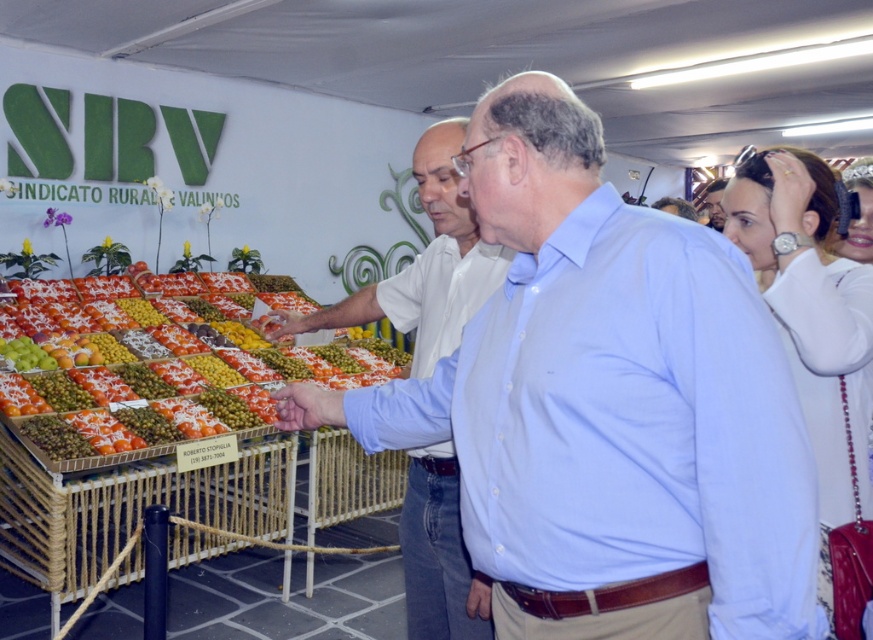
Question: Among these points, which one is nearest to the camera?

Choices:
 (A) (111, 280)
 (B) (413, 314)
 (C) (709, 186)

Answer: (B)

Question: Which object is the closest to the matte white shirt at center?

Choices:
 (A) shiny plastic tray at center
 (B) light blue shirt at center

Answer: (B)

Question: Can you confirm if light blue shirt at center is positioned above matte white shirt at center?

Choices:
 (A) yes
 (B) no

Answer: (B)

Question: Observing the image, what is the correct spatial positioning of shiny plastic tray at center in reference to matte white shirt at center?

Choices:
 (A) below
 (B) above

Answer: (A)

Question: Estimate the real-world distances between objects in this image. Which object is closer to the light blue shirt at center?

Choices:
 (A) matte white shirt at center
 (B) shiny plastic tray at center

Answer: (A)

Question: Does shiny plastic tray at center appear under matte white shirt at center?

Choices:
 (A) yes
 (B) no

Answer: (A)